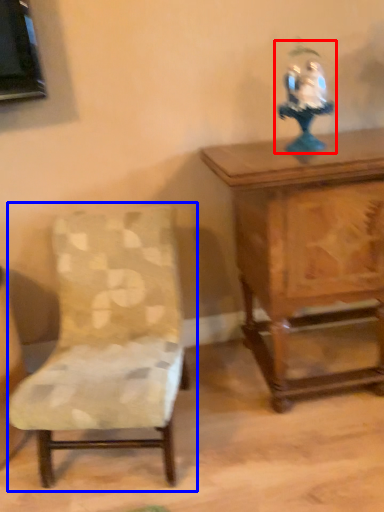
Question: Among these objects, which one is farthest to the camera, toy (highlighted by a red box) or chair (highlighted by a blue box)?

Choices:
 (A) toy
 (B) chair

Answer: (A)